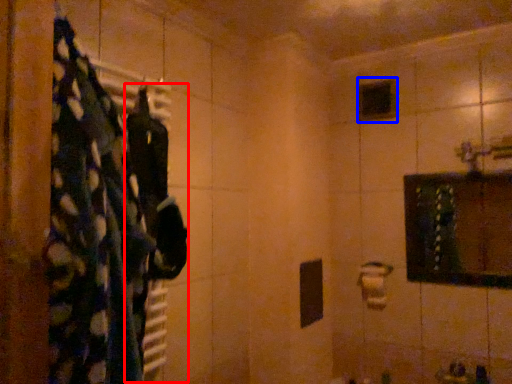
Question: Which of the following is the farthest to the observer, clothing (highlighted by a red box) or mirror (highlighted by a blue box)?

Choices:
 (A) clothing
 (B) mirror

Answer: (B)